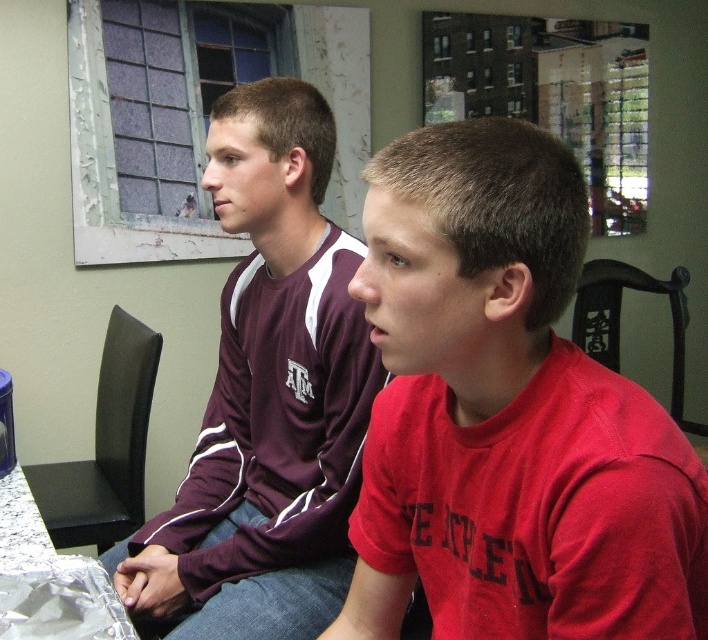
You are standing in the room and want to determine which of the two points, point (542, 189) or point (331, 244), is nearer to you. Based on the scene description, which point is closer?

Point (542, 189) is closer to the camera than point (331, 244), so it is the nearer point.

You are trying to decide which shirt to wear for a casual day out. Both the red matte shirt at center and the maroon jersey at center are options. Based on their sizes, which one might be more comfortable for layering under a jacket?

The red matte shirt at center has a smaller width than the maroon jersey at center, so it might be more comfortable for layering under a jacket since it is narrower and less bulky.